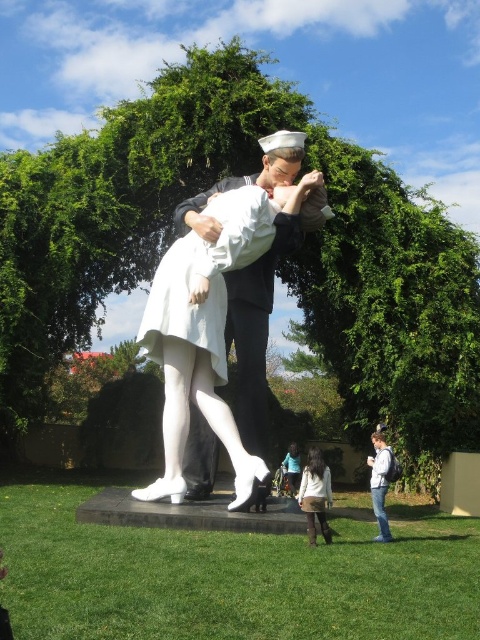
Can you confirm if white glossy statue at center is positioned to the right of white matte dress at center?

In fact, white glossy statue at center is to the left of white matte dress at center.

Is white glossy statue at center in front of white matte dress at center?

Yes, white glossy statue at center is in front of white matte dress at center.

Who is more distant from viewer, (200, 298) or (300, 458)?

Positioned behind is point (300, 458).

Find the location of a particular element. white glossy statue at center is located at coordinates (x=229, y=317).

Who is more forward, (317, 224) or (320, 509)?

Point (320, 509)

From the picture: Does white glossy statue at center have a lesser width compared to white matte skirt at lower center?

In fact, white glossy statue at center might be wider than white matte skirt at lower center.

Which is in front, point (241, 408) or point (308, 502)?

Positioned in front is point (308, 502).

This screenshot has width=480, height=640. In order to click on white glossy statue at center in this screenshot , I will do `click(229, 317)`.

Between point (315, 541) and point (289, 445), which one is positioned in front?

Point (315, 541)

Consider the image. Measure the distance between white matte skirt at lower center and white matte dress at center.

white matte skirt at lower center and white matte dress at center are 22.92 feet apart.

Between point (312, 536) and point (290, 493), which one is positioned in front?

Point (312, 536)

The width and height of the screenshot is (480, 640). Find the location of `white matte skirt at lower center`. white matte skirt at lower center is located at coordinates (315, 493).